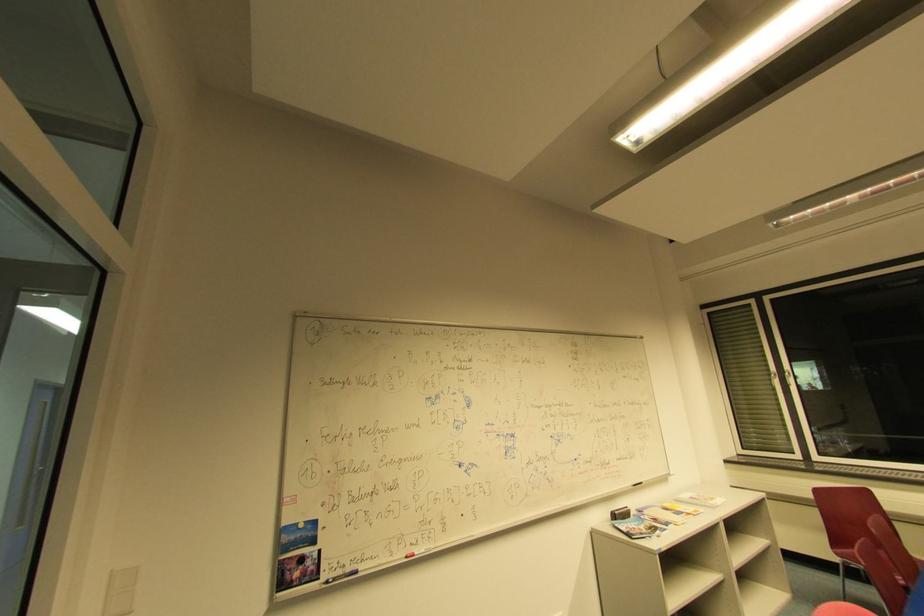
Where is `door handle`? The width and height of the screenshot is (924, 616). door handle is located at coordinates (61, 407).